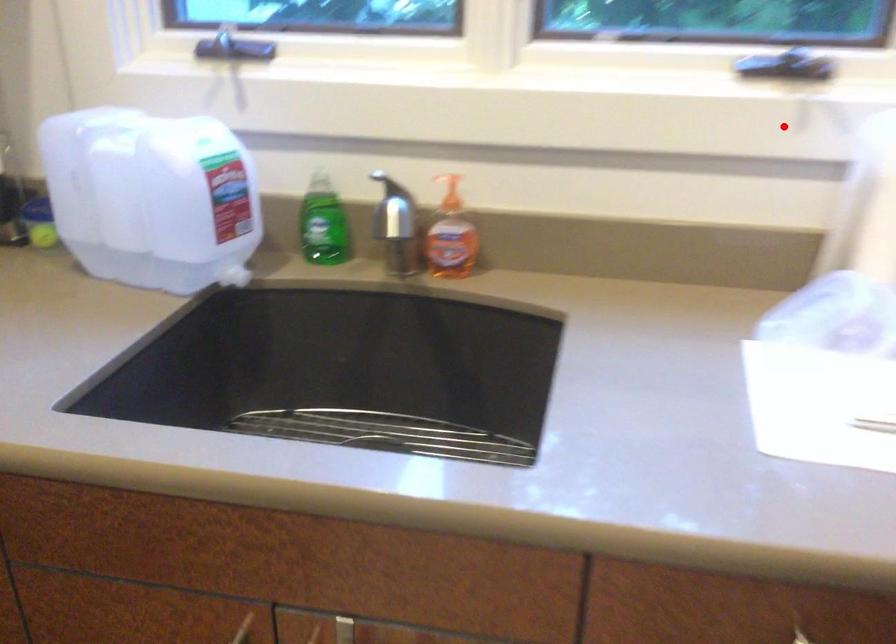
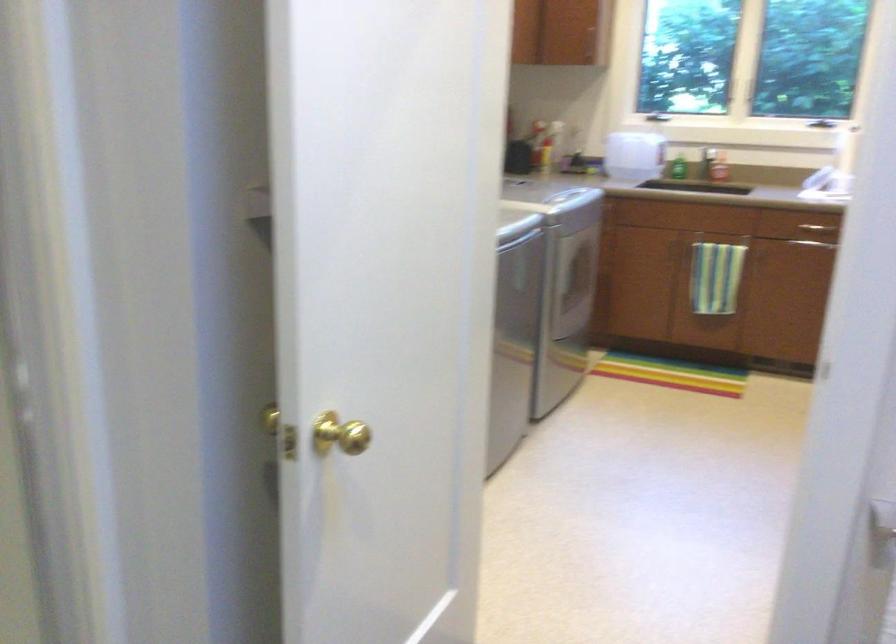
Question: A red point is marked in image1. In image2, is the corresponding 3D point closer to the camera or farther? Reply with the corresponding letter.

Choices:
 (A) The corresponding 3D point is closer.
 (B) The corresponding 3D point is farther.

Answer: (B)